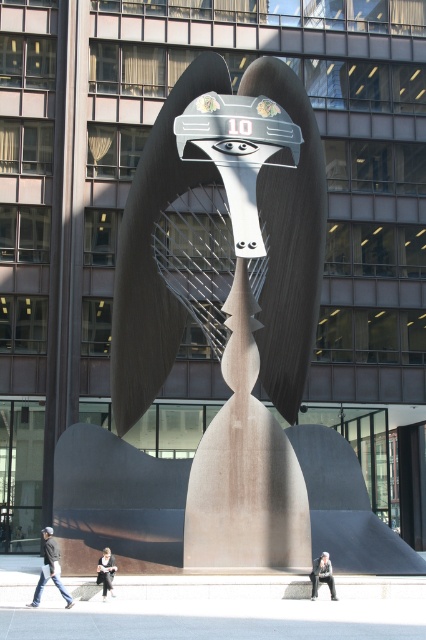
Question: Which object is the farthest from the dark gray concrete figure at center?

Choices:
 (A) dark gray concrete statue at center
 (B) dark blue jeans at lower left

Answer: (A)

Question: Which point appears farthest from the camera in this image?

Choices:
 (A) (108, 586)
 (B) (48, 548)
 (C) (319, 570)

Answer: (C)

Question: Does dark blue jeans at lower left lie in front of dark gray concrete figure at center?

Choices:
 (A) yes
 (B) no

Answer: (A)

Question: Among these objects, which one is farthest from the camera?

Choices:
 (A) matte bronze sculpture at center
 (B) dark gray concrete figure at center

Answer: (A)

Question: Is matte bronze sculpture at center positioned behind dark gray concrete figure at center?

Choices:
 (A) yes
 (B) no

Answer: (A)

Question: Can you confirm if matte bronze sculpture at center is positioned above dark gray concrete statue at center?

Choices:
 (A) yes
 (B) no

Answer: (A)